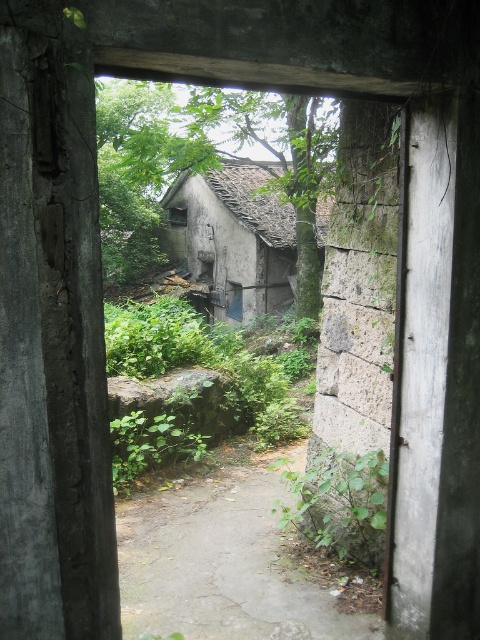
Question: In this image, where is dull gray concrete path at center located relative to weathered stone hut at center?

Choices:
 (A) left
 (B) right

Answer: (B)

Question: Which object appears farthest from the camera in this image?

Choices:
 (A) weathered stone hut at center
 (B) dull gray concrete path at center

Answer: (A)

Question: Can you confirm if dull gray concrete path at center is positioned below weathered stone hut at center?

Choices:
 (A) yes
 (B) no

Answer: (A)

Question: Which point appears farthest from the camera in this image?

Choices:
 (A) click(265, 497)
 (B) click(168, 236)

Answer: (B)

Question: Can you confirm if dull gray concrete path at center is wider than weathered stone hut at center?

Choices:
 (A) no
 (B) yes

Answer: (A)